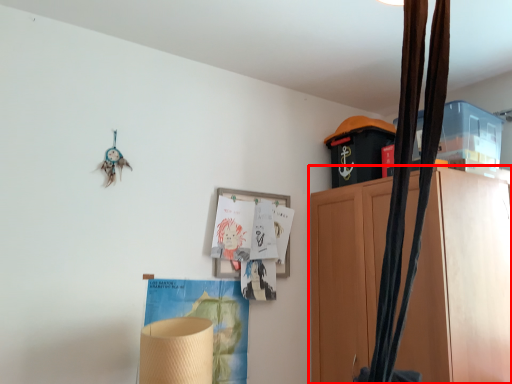
Question: Observing the image, what is the correct spatial positioning of cabinetry (annotated by the red box) in reference to picture frame?

Choices:
 (A) right
 (B) left

Answer: (A)